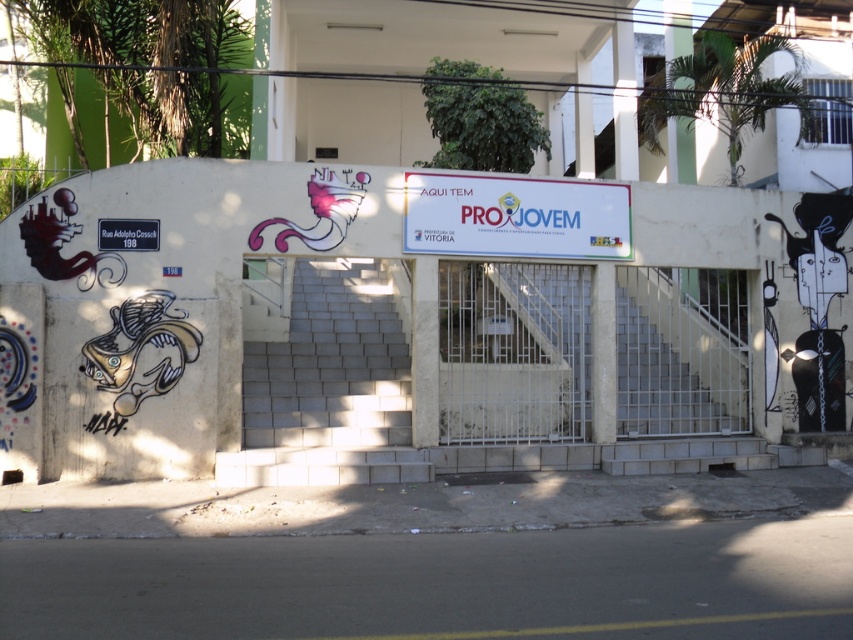
Question: Where is white plastic sign at center located in relation to white matte street sign at left in the image?

Choices:
 (A) right
 (B) left

Answer: (A)

Question: Considering the relative positions of white plastic sign at center and white matte street sign at left in the image provided, where is white plastic sign at center located with respect to white matte street sign at left?

Choices:
 (A) below
 (B) above

Answer: (B)

Question: Which object appears farthest from the camera in this image?

Choices:
 (A) white plastic sign at center
 (B) white matte street sign at left

Answer: (A)

Question: Is white plastic sign at center thinner than white matte street sign at left?

Choices:
 (A) no
 (B) yes

Answer: (A)